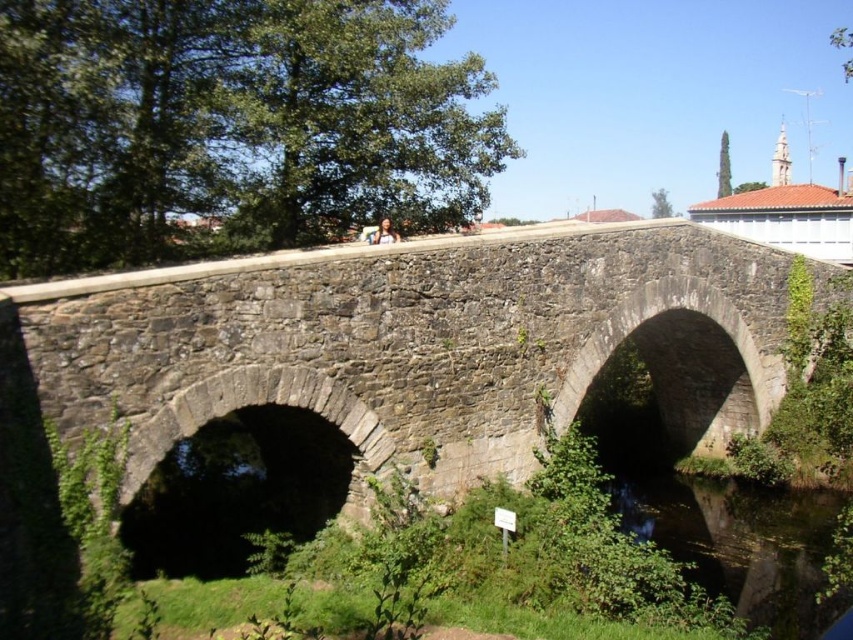
Question: Which object is farther from the camera taking this photo?

Choices:
 (A) gray stone bridge at center
 (B) clear water at bridge bottom

Answer: (B)

Question: Can you confirm if gray stone bridge at center is smaller than clear water at bridge bottom?

Choices:
 (A) yes
 (B) no

Answer: (B)

Question: Is gray stone bridge at center thinner than clear water at bridge bottom?

Choices:
 (A) no
 (B) yes

Answer: (A)

Question: Does gray stone bridge at center have a greater width compared to clear water at bridge bottom?

Choices:
 (A) no
 (B) yes

Answer: (B)

Question: Which point is closer to the camera?

Choices:
 (A) (468, 301)
 (B) (779, 545)

Answer: (A)

Question: Which point is farther to the camera?

Choices:
 (A) gray stone bridge at center
 (B) clear water at bridge bottom

Answer: (B)